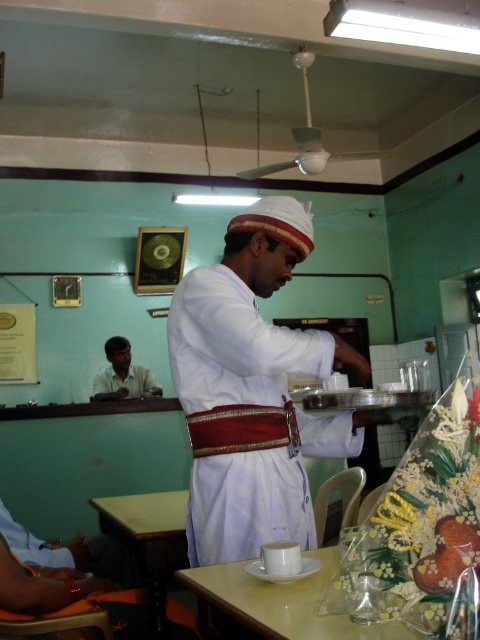
The height and width of the screenshot is (640, 480). What do you see at coordinates (151, 540) in the screenshot?
I see `wooden table at lower left` at bounding box center [151, 540].

Is point (145, 524) in front of point (463, 554)?

That is False.

Identify the location of wooden table at lower left. This screenshot has height=640, width=480. (151, 540).

Which is behind, point (119, 497) or point (95, 388)?

The point (95, 388) is more distant.

Is wooden table at lower left further to the viewer compared to matte white shirt at lower left?

No, wooden table at lower left is in front of matte white shirt at lower left.

This screenshot has height=640, width=480. I want to click on wooden table at lower left, so click(151, 540).

Where is `wooden table at lower left`? The height and width of the screenshot is (640, 480). wooden table at lower left is located at coordinates 151,540.

Who is positioned more to the left, white glossy table at lower center or matte white shirt at lower left?

matte white shirt at lower left is more to the left.

Based on the photo, can you confirm if white glossy table at lower center is wider than matte white shirt at lower left?

Incorrect, white glossy table at lower center's width does not surpass matte white shirt at lower left's.

Between point (204, 586) and point (129, 362), which one is positioned in front?

Point (204, 586) is more forward.

The width and height of the screenshot is (480, 640). Identify the location of white glossy table at lower center. (284, 602).